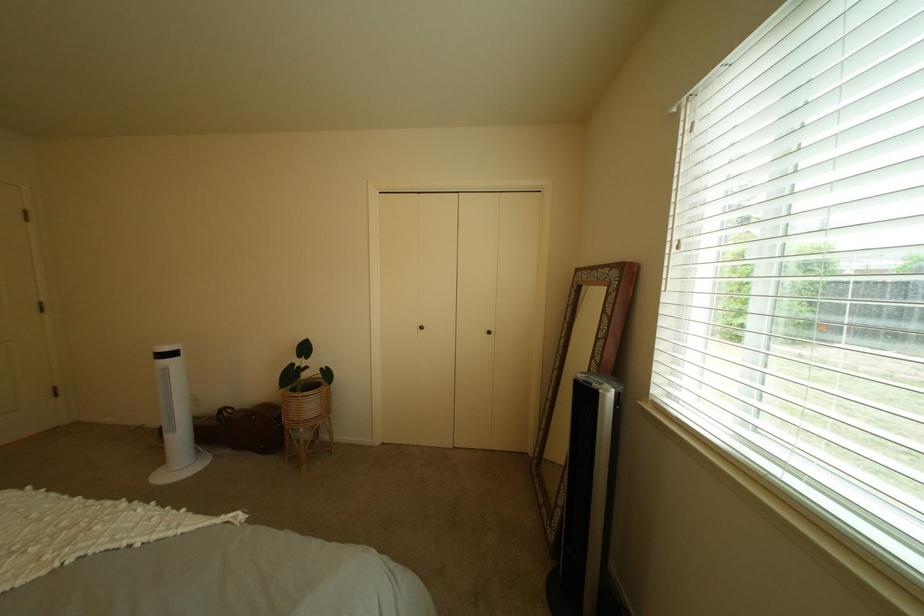
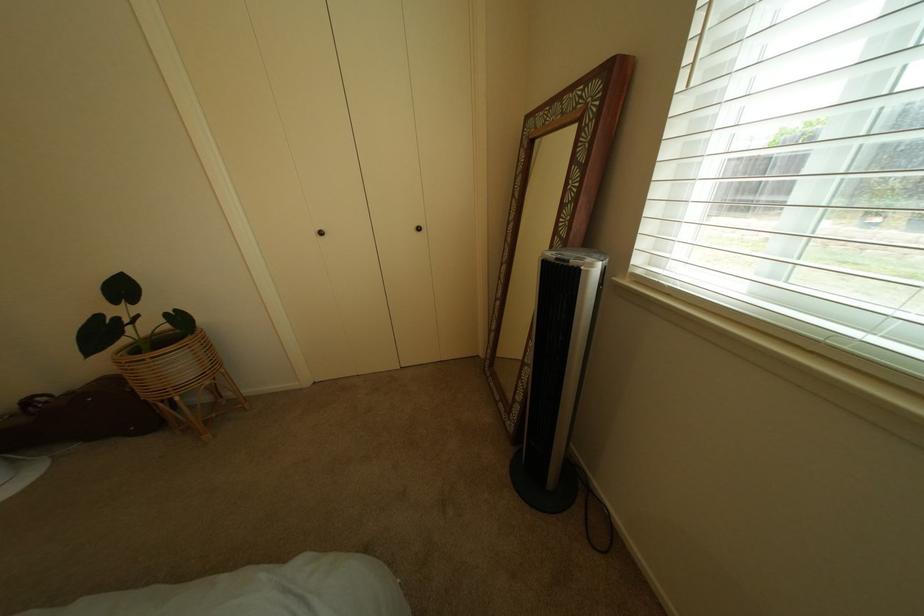
The point at (606, 386) is marked in the first image. Where is the corresponding point in the second image?

(584, 262)